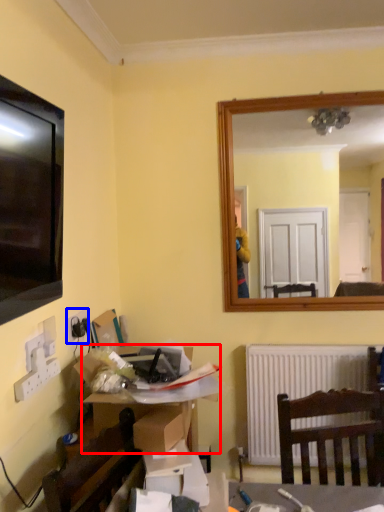
Question: Among these objects, which one is farthest to the camera, desk (highlighted by a red box) or electric outlet (highlighted by a blue box)?

Choices:
 (A) desk
 (B) electric outlet

Answer: (B)